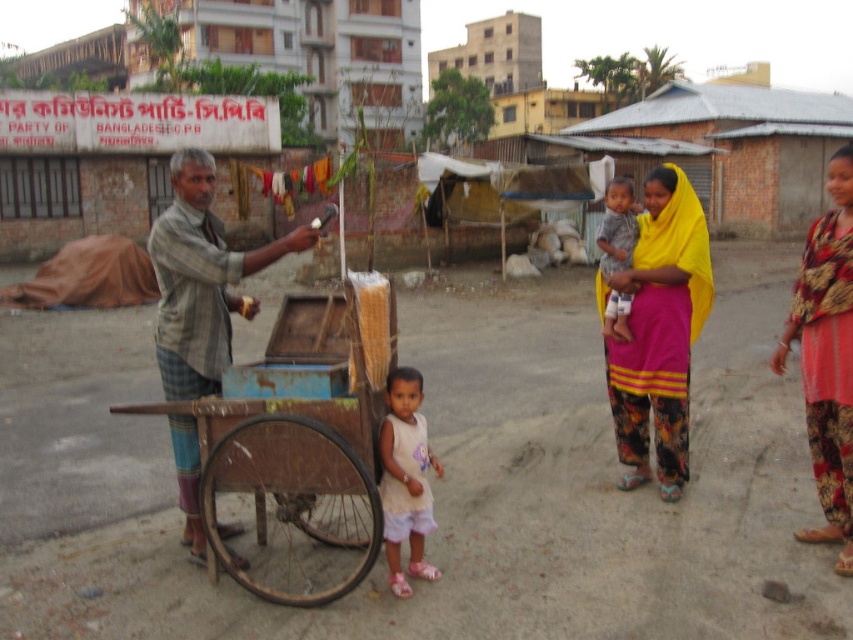
You are a customer at the market and see both the striped fabric man at center and the white cotton dress at center. Which one is more to the left?

The striped fabric man at center is more to the left side of the white cotton dress at center.

You are a fashion designer visiting Bangladesh and see the striped fabric man at center and the white cotton dress at center in the scene. Which clothing item is taller?

The striped fabric man at center is much taller than the white cotton dress at center.